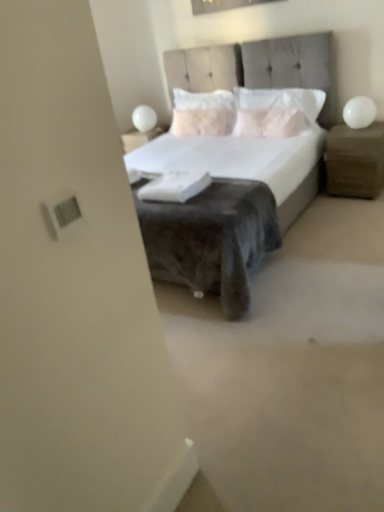
Question: From the image's perspective, is wooden nightstand at right located above or below white glossy table lamp at upper right, the 2th table lamp positioned from the top?

Choices:
 (A) below
 (B) above

Answer: (A)

Question: Which is correct: wooden nightstand at right is inside white glossy table lamp at upper right, positioned as the 1th table lamp in bottom-to-top order, or outside of it?

Choices:
 (A) inside
 (B) outside

Answer: (B)

Question: Which object is the farthest from the velvet gray bed at center?

Choices:
 (A) white glossy table lamp at upper right, the 2th table lamp positioned from the top
 (B) white soft pillow at center, acting as the second pillow starting from the left
 (C) white textured pillow at center, marked as the 1th pillow in a left-to-right arrangement
 (D) wooden nightstand at right
 (E) white glossy sphere at upper left, positioned as the 1th table lamp in back-to-front order

Answer: (E)

Question: Considering the real-world distances, which object is farthest from the white glossy sphere at upper left, which is the second table lamp from right to left?

Choices:
 (A) wooden nightstand at right
 (B) velvet gray bed at center
 (C) white soft pillow at center, the first pillow in the right-to-left sequence
 (D) white glossy table lamp at upper right, which is the 1th table lamp in right-to-left order
 (E) white textured pillow at center, which is the 2th pillow from right to left

Answer: (A)